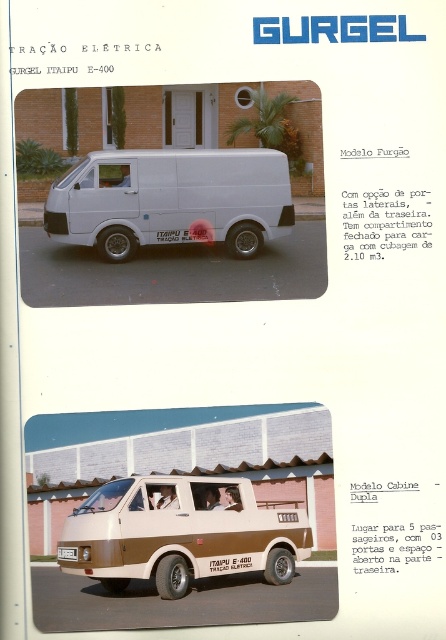
Question: Which of the following is the farthest from the observer?

Choices:
 (A) brown matte van at center
 (B) white matte van at center
 (C) white plastic license plate at bottom center

Answer: (B)

Question: Can you confirm if brown matte van at center is positioned to the right of white plastic license plate at bottom center?

Choices:
 (A) no
 (B) yes

Answer: (B)

Question: Is brown matte van at center thinner than white matte van at center?

Choices:
 (A) no
 (B) yes

Answer: (B)

Question: Where is brown matte van at center located in relation to white matte van at center in the image?

Choices:
 (A) below
 (B) above

Answer: (A)

Question: Which object appears closest to the camera in this image?

Choices:
 (A) white matte van at center
 (B) brown matte van at center
 (C) white plastic license plate at bottom center

Answer: (B)

Question: Which point is farther from the camera taking this photo?

Choices:
 (A) (226, 234)
 (B) (177, 584)

Answer: (A)